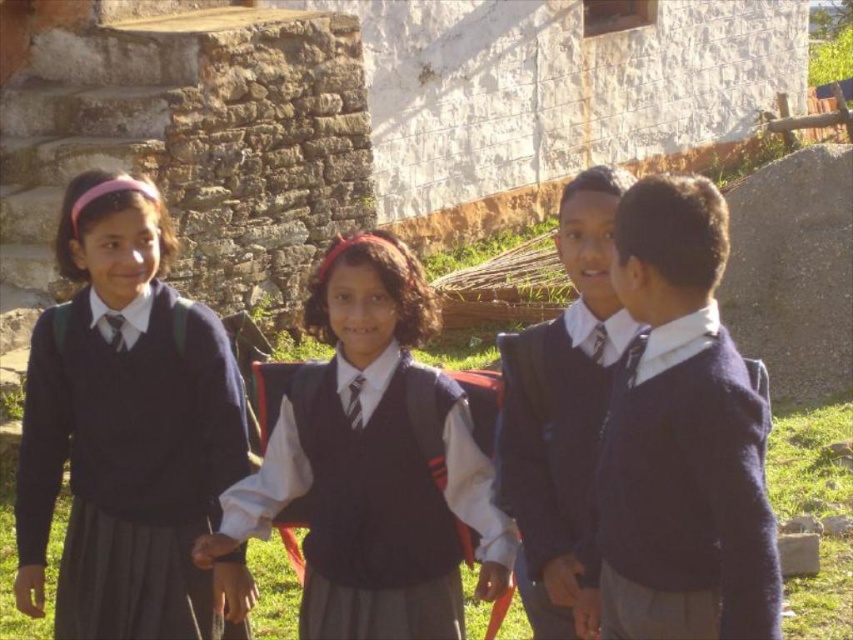
Looking at this image, you are a photographer trying to capture a photo of the matte black sweater at left and the matte blue sweater at right. Which sweater should you focus on first if you want to capture them from left to right in the frame?

The matte black sweater at left should be focused on first since it is positioned on the left side of the matte blue sweater at right, so capturing them from left to right would start with the matte black sweater at left.

You are a tailor observing two children wearing matte black sweater at left and matte black sweater at center. Which child is wearing a wider sweater?

The matte black sweater at center is wider than the matte black sweater at left.

You are a photographer trying to capture a photo of the matte black sweater at center without including the matte blue sweater at right. Given their positions, is this possible?

The matte blue sweater at right is positioned under the matte black sweater at center, so it might be possible to angle the camera upwards to capture the matte black sweater at center without the matte blue sweater at right appearing in the frame.